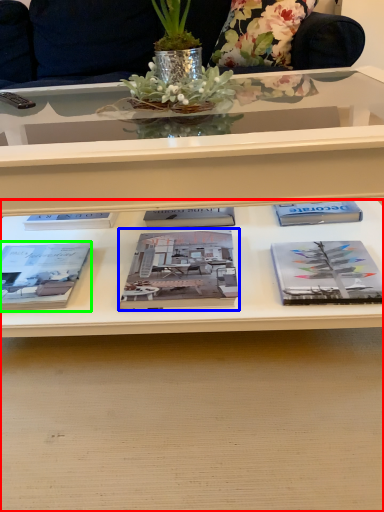
Question: Which is farther away from desk (highlighted by a red box)? book (highlighted by a blue box) or book (highlighted by a green box)?

Choices:
 (A) book
 (B) book

Answer: (B)